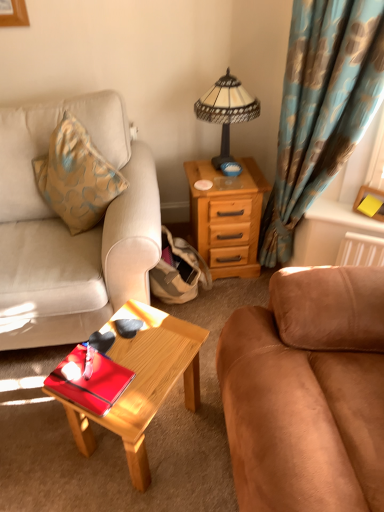
The width and height of the screenshot is (384, 512). In order to click on empty space that is ontop of shiny wood coffee table at center in this screenshot , I will do `click(143, 354)`.